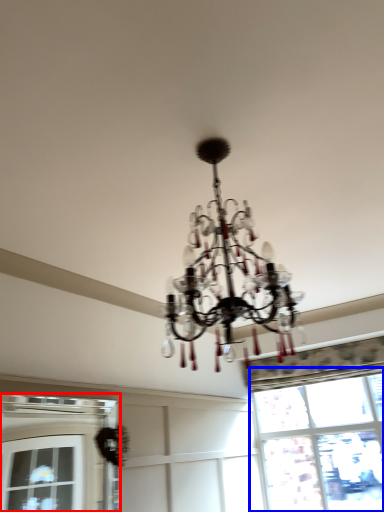
Question: Among these objects, which one is nearest to the camera, window (highlighted by a red box) or window (highlighted by a blue box)?

Choices:
 (A) window
 (B) window

Answer: (A)